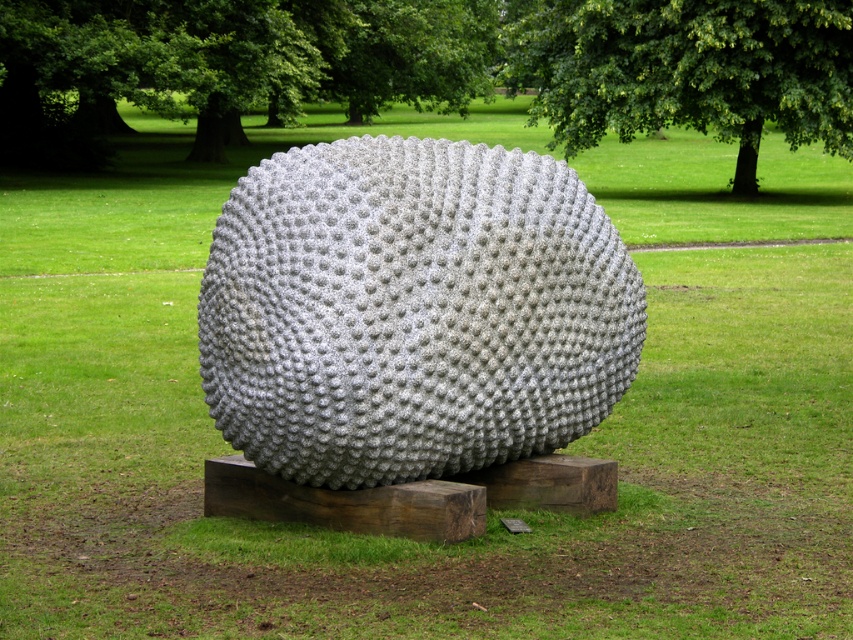
Based on the photo, you are a landscape architect designing a new park layout. You need to place a new bench that must be equidistant from both the sanded concrete sphere at center and the green leafy tree at upper center. Considering their sizes, which object should the bench be placed closer to to maintain equal distance?

The bench should be placed closer to the sanded concrete sphere at center because it occupies less space than the green leafy tree at upper center, so to maintain equal distance from both, it needs to be nearer to the smaller object.

Consider the image. You are standing in the park and want to take a photo of the sanded concrete sphere at center without any obstructions. However, there is a green leafy tree at upper center in the background. Can you position yourself in a way that the tree does not block the view of the sphere?

The sanded concrete sphere at center is in front of the green leafy tree at upper center, so you can position yourself behind the sphere to ensure the tree does not block the view.